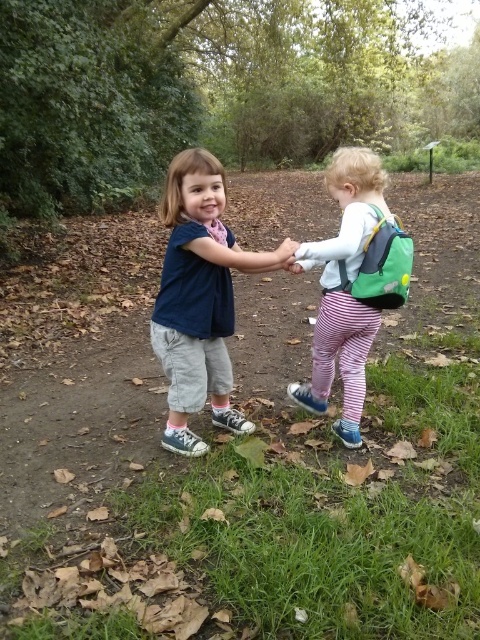
Between matte blue shirt at center and striped cotton pants at center, which one appears on the right side from the viewer's perspective?

From the viewer's perspective, striped cotton pants at center appears more on the right side.

From the picture: Is matte blue shirt at center shorter than striped cotton pants at center?

Correct, matte blue shirt at center is not as tall as striped cotton pants at center.

Locate an element on the screen. The image size is (480, 640). matte blue shirt at center is located at coordinates (200, 298).

Between matte blue shirt at center and green fabric backpack at right, which one has more height?

Standing taller between the two is matte blue shirt at center.

The height and width of the screenshot is (640, 480). What do you see at coordinates (200, 298) in the screenshot?
I see `matte blue shirt at center` at bounding box center [200, 298].

At what (x,y) coordinates should I click in order to perform the action: click on matte blue shirt at center. Please return your answer as a coordinate pair (x, y). The image size is (480, 640). Looking at the image, I should click on (200, 298).

Can you confirm if striped cotton pants at center is bigger than green fabric backpack at right?

Indeed, striped cotton pants at center has a larger size compared to green fabric backpack at right.

Is striped cotton pants at center further to camera compared to green fabric backpack at right?

No, it is not.

Image resolution: width=480 pixels, height=640 pixels. What do you see at coordinates (344, 289) in the screenshot? I see `striped cotton pants at center` at bounding box center [344, 289].

Where is `striped cotton pants at center`? striped cotton pants at center is located at coordinates (344, 289).